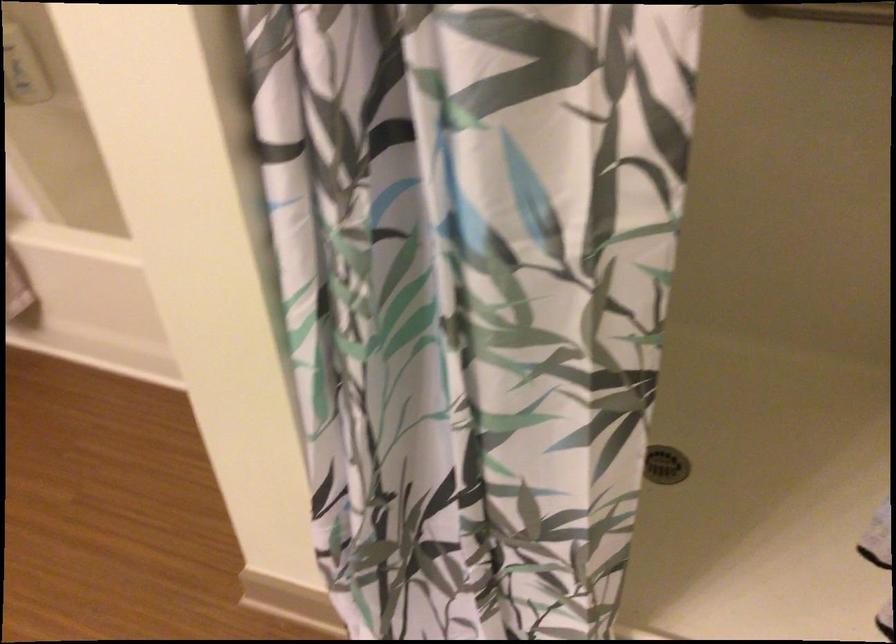
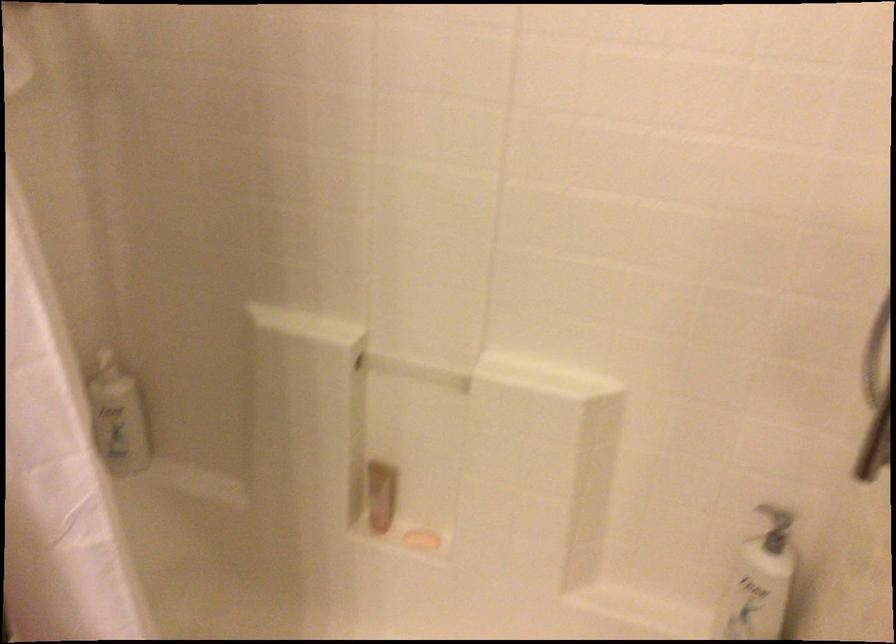
The images are taken continuously from a first-person perspective. In which direction are you moving?

The cameraman walked toward left, forward.